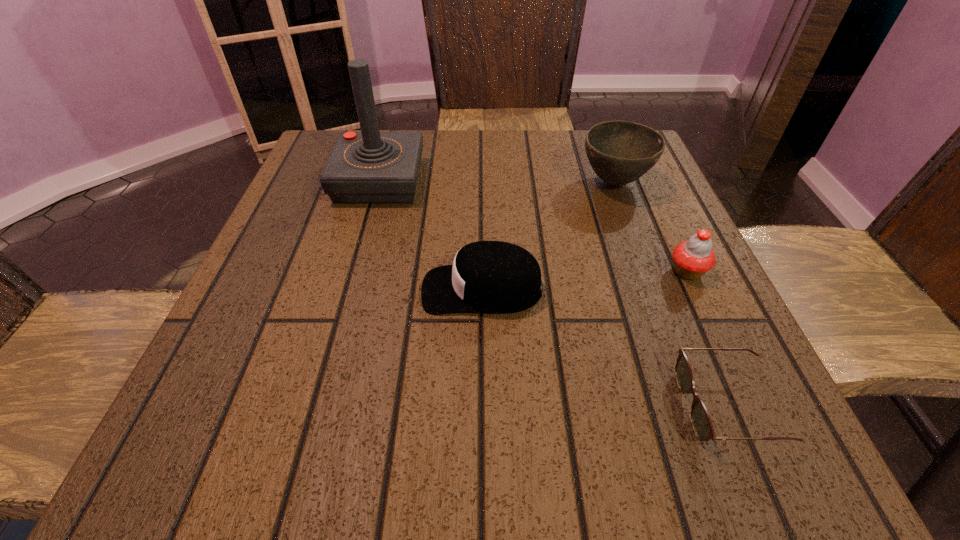
Locate an element on the screen. vacant region located 0.230m on the front-facing side of the cap is located at coordinates (285, 289).

At what (x,y) coordinates should I click in order to perform the action: click on free space located on the front-facing side of the cap. Please return your answer as a coordinate pair (x, y). The width and height of the screenshot is (960, 540). Looking at the image, I should click on (285, 289).

Locate an element on the screen. This screenshot has height=540, width=960. vacant space located on the front-facing side of the cap is located at coordinates coord(363,289).

The height and width of the screenshot is (540, 960). In order to click on free space located at the front view of the nearest object in this screenshot , I will do point(529,406).

Find the location of a particular element. free location located at the front view of the nearest object is located at coordinates (388, 406).

Locate an element on the screen. Image resolution: width=960 pixels, height=540 pixels. vacant area situated at the front view of the nearest object is located at coordinates (447, 406).

Where is `joystick at the far edge`? joystick at the far edge is located at coordinates coord(369,167).

At what (x,y) coordinates should I click in order to perform the action: click on bowl present at the far edge. Please return your answer as a coordinate pair (x, y). Looking at the image, I should click on (620, 152).

The height and width of the screenshot is (540, 960). Find the location of `object that is positioned at the near edge`. object that is positioned at the near edge is located at coordinates (702, 425).

The image size is (960, 540). I want to click on object present at the left edge, so click(x=369, y=167).